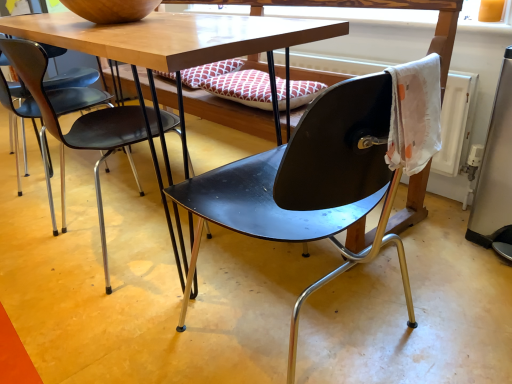
I want to click on vacant space behind matte black chair at center, the 2th chair in the right-to-left sequence, so click(x=119, y=188).